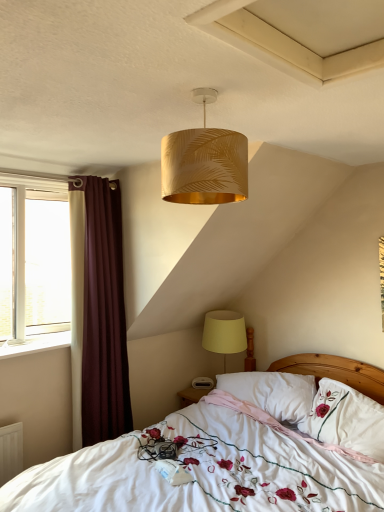
Identify the location of blank space situated above gold leaf-patterned lampshade at upper center, marked as the first lamp in a front-to-back arrangement (from a real-world perspective). (202, 92).